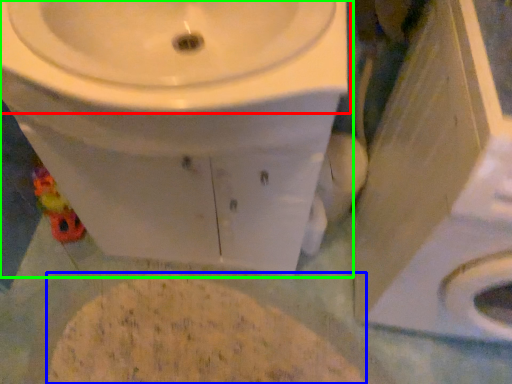
Question: Which is farther away from sink (highlighted by a red box)? flour (highlighted by a blue box) or toilet (highlighted by a green box)?

Choices:
 (A) flour
 (B) toilet

Answer: (A)